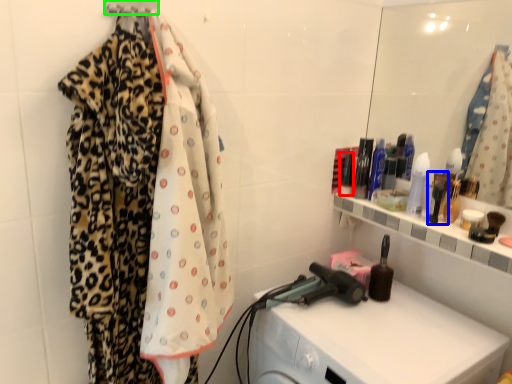
Question: Which object is the farthest from toiletry (highlighted by a red box)? Choose among these: toiletry (highlighted by a blue box) or hanger (highlighted by a green box).

Choices:
 (A) toiletry
 (B) hanger

Answer: (B)